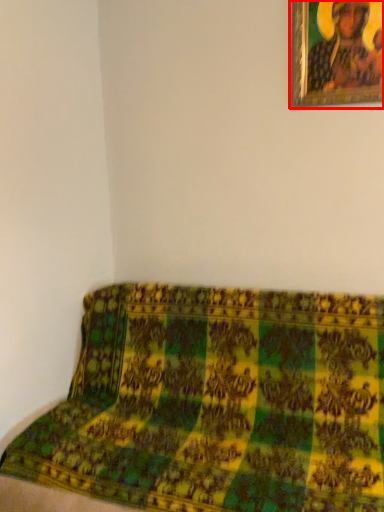
Question: From the image's perspective, considering the relative positions of picture frame (annotated by the red box) and furniture in the image provided, where is picture frame (annotated by the red box) located with respect to the staircase?

Choices:
 (A) below
 (B) above

Answer: (B)